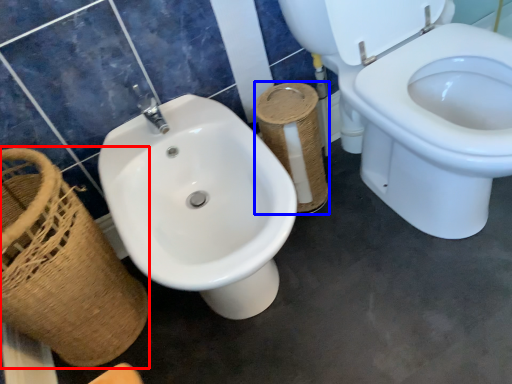
Question: Which of the following is the farthest to the observer, basket (highlighted by a red box) or toilet paper (highlighted by a blue box)?

Choices:
 (A) basket
 (B) toilet paper

Answer: (B)